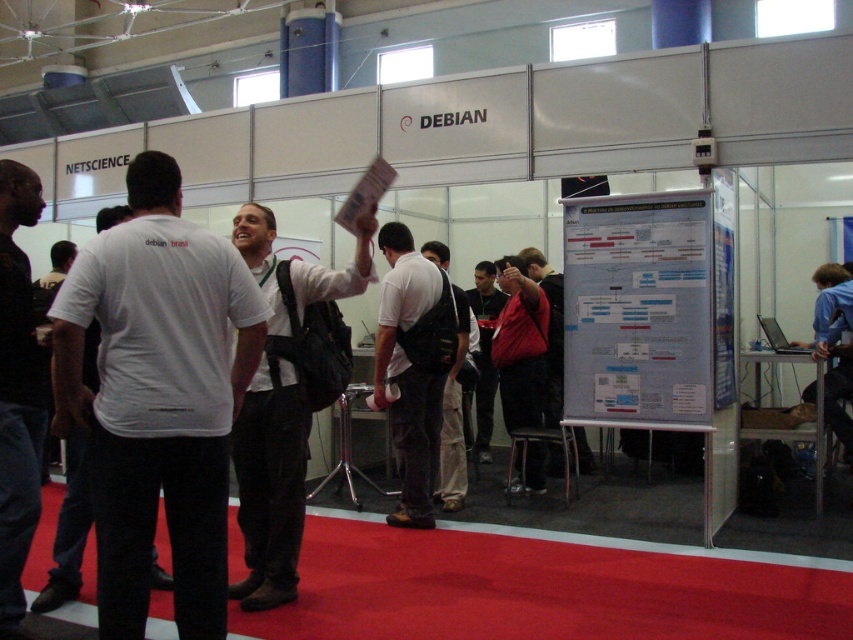
Question: Can you confirm if white cotton t-shirt at center is smaller than dark gray jeans at left?

Choices:
 (A) yes
 (B) no

Answer: (B)

Question: Estimate the real-world distances between objects in this image. Which object is farther from the white matte t-shirt at center?

Choices:
 (A) dark gray jeans at left
 (B) white paper at center
 (C) dark gray shirt at center

Answer: (C)

Question: Estimate the real-world distances between objects in this image. Which object is farther from the white paper at center?

Choices:
 (A) dark gray shirt at center
 (B) white fabric backpack at center
 (C) white matte shirt at center
 (D) white matte t-shirt at center

Answer: (D)

Question: Which point appears closest to the camera in this image?

Choices:
 (A) (732, 227)
 (B) (85, 464)

Answer: (B)

Question: Observing the image, what is the correct spatial positioning of white cotton t-shirt at center in reference to white paper at center?

Choices:
 (A) right
 (B) left

Answer: (B)

Question: Is dark gray fabric backpack at center positioned before white fabric backpack at center?

Choices:
 (A) no
 (B) yes

Answer: (B)